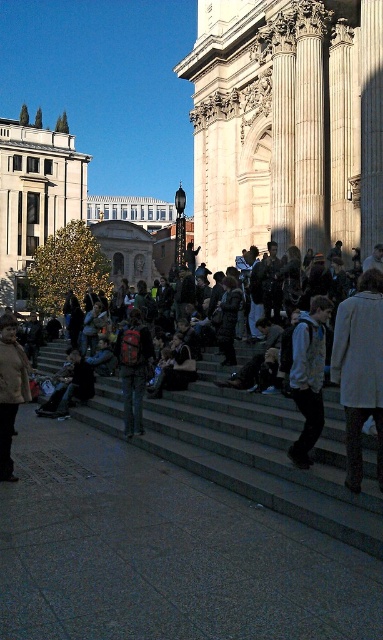
In the scene shown: You are a photographer trying to capture a photo of the light gray coat at center and the light blue denim jacket at center. Which one is closer to the camera?

The light gray coat at center is positioned under the light blue denim jacket at center, so the light blue denim jacket at center is closer to the camera.